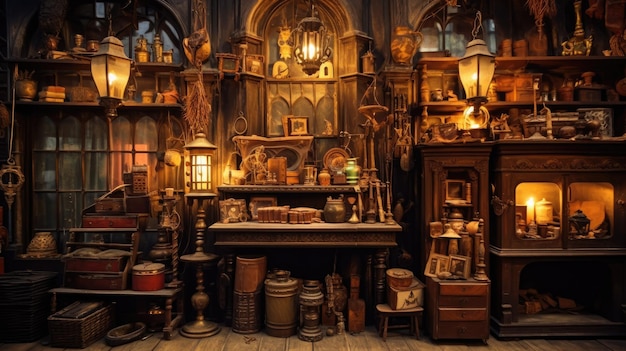
Identify the location of urns. (41, 248), (409, 42).